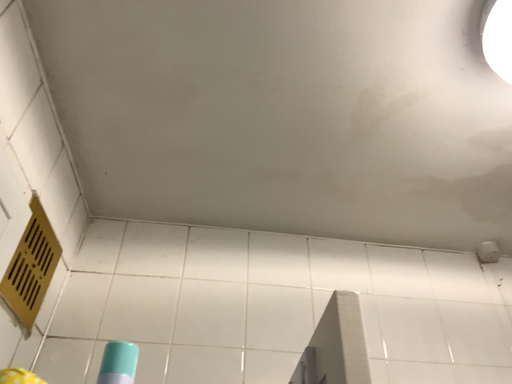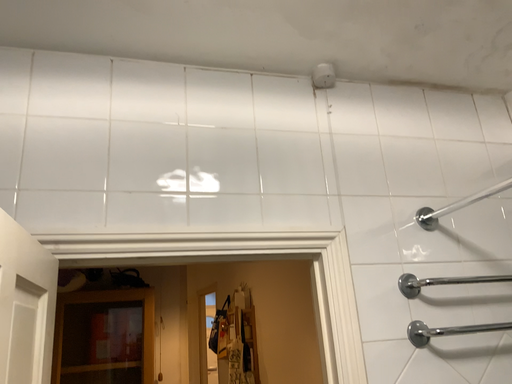
Question: How did the camera likely rotate when shooting the video?

Choices:
 (A) rotated right
 (B) rotated left

Answer: (A)